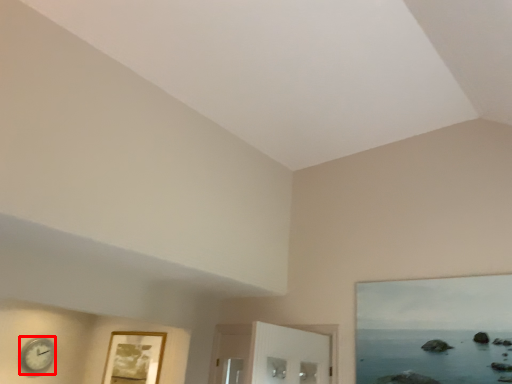
Question: From the image's perspective, what is the correct spatial relationship of clock (annotated by the red box) in relation to picture frame?

Choices:
 (A) above
 (B) below

Answer: (B)